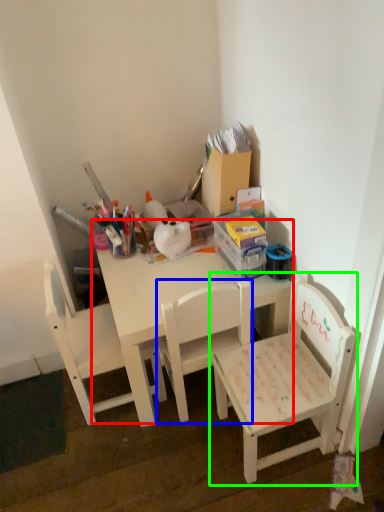
Question: Estimate the real-world distances between objects in this image. Which object is closer to table (highlighted by a red box), chair (highlighted by a blue box) or chair (highlighted by a green box)?

Choices:
 (A) chair
 (B) chair

Answer: (A)